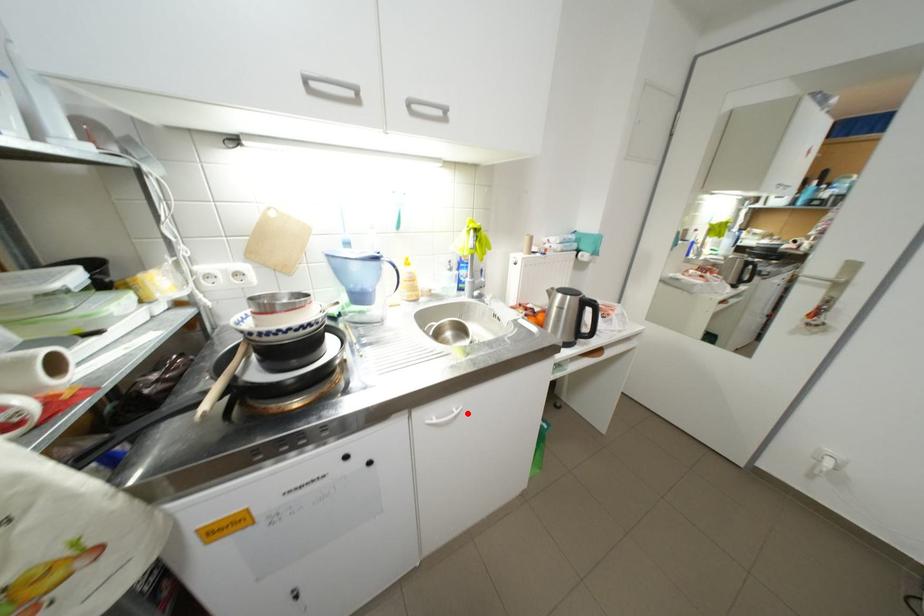
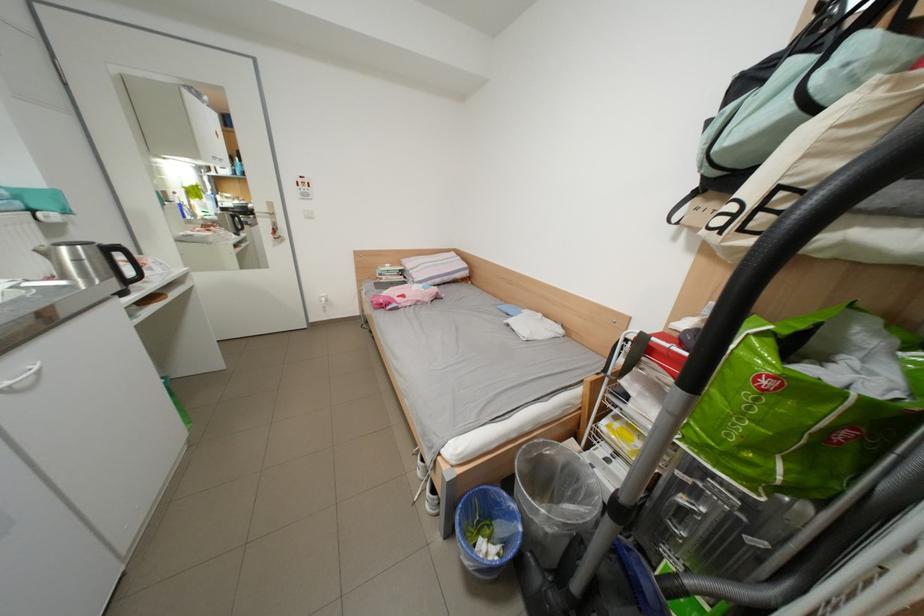
Question: I am providing you with two images of the same scene from different viewpoints. Image1 has a red point marked. In image2, the corresponding 3D location appears at what relative position? Reply with the corresponding letter.

Choices:
 (A) Closer
 (B) Farther

Answer: (B)